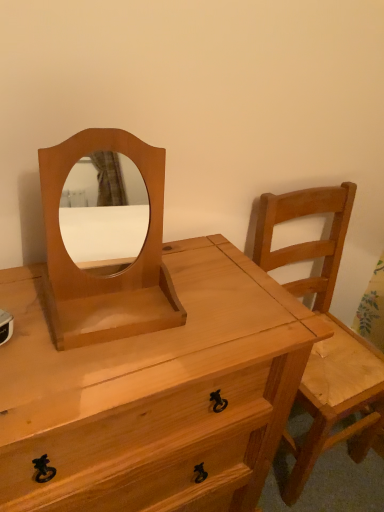
Where is `space that is in front of light brown wood mirror at center`? space that is in front of light brown wood mirror at center is located at coordinates (83, 376).